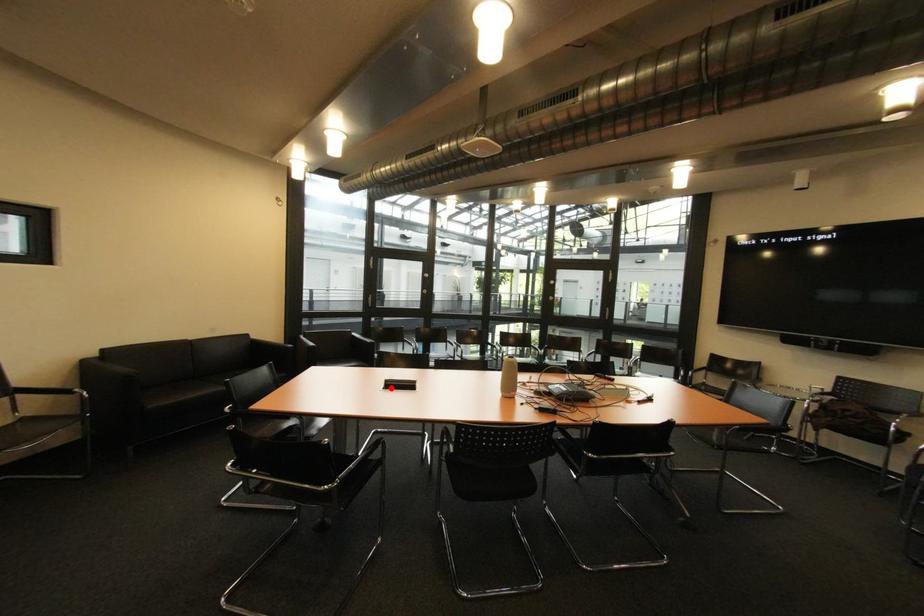
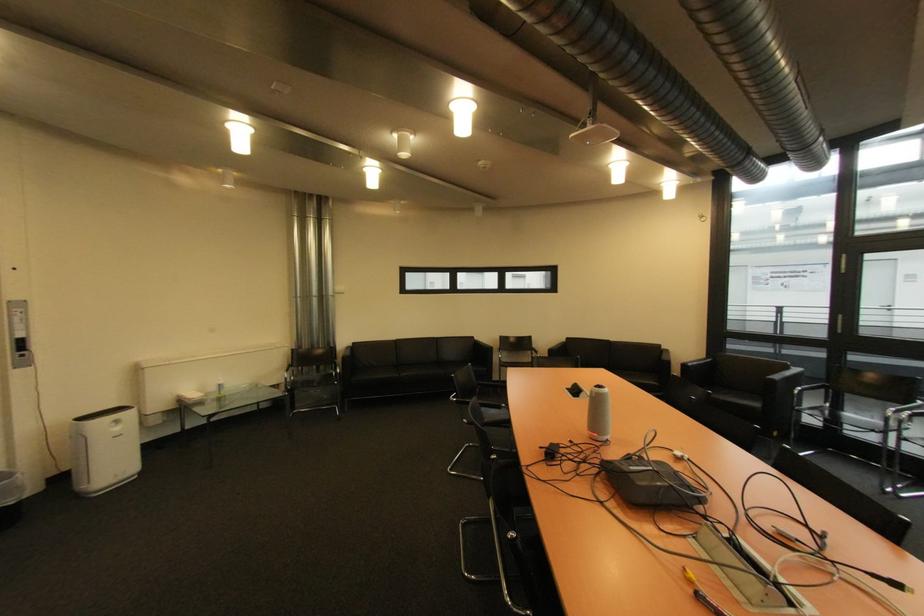
Find the pixel in the second image that matches the highlighted location in the first image.

(578, 389)